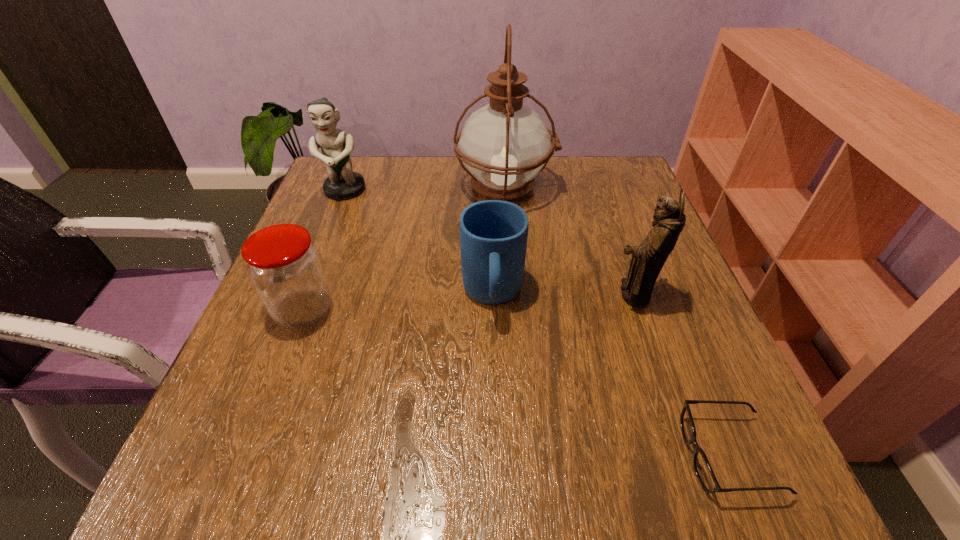
Find the location of a particular element. The height and width of the screenshot is (540, 960). blank area at the far left corner is located at coordinates (375, 160).

The height and width of the screenshot is (540, 960). In the image, there is a desktop. What are the coordinates of `vacant space at the far right corner` in the screenshot? It's located at (587, 203).

Find the location of a particular element. This screenshot has width=960, height=540. vacant area at the near right corner of the desktop is located at coordinates (705, 496).

I want to click on free space that is in between the mug and the jar, so click(x=397, y=303).

What are the coordinates of `free space between the jar and the oil lamp` in the screenshot? It's located at (404, 249).

The width and height of the screenshot is (960, 540). What are the coordinates of `free space that is in between the jar and the left figurine` in the screenshot? It's located at (324, 251).

Where is `unoccupied position between the mug and the right figurine`? Image resolution: width=960 pixels, height=540 pixels. unoccupied position between the mug and the right figurine is located at coordinates (563, 295).

The image size is (960, 540). I want to click on vacant area that lies between the oil lamp and the nearest object, so click(616, 321).

What are the coordinates of `free space between the oil lamp and the left figurine` in the screenshot? It's located at (424, 190).

This screenshot has height=540, width=960. Identify the location of vacant space that is in between the right figurine and the nearest object. (680, 374).